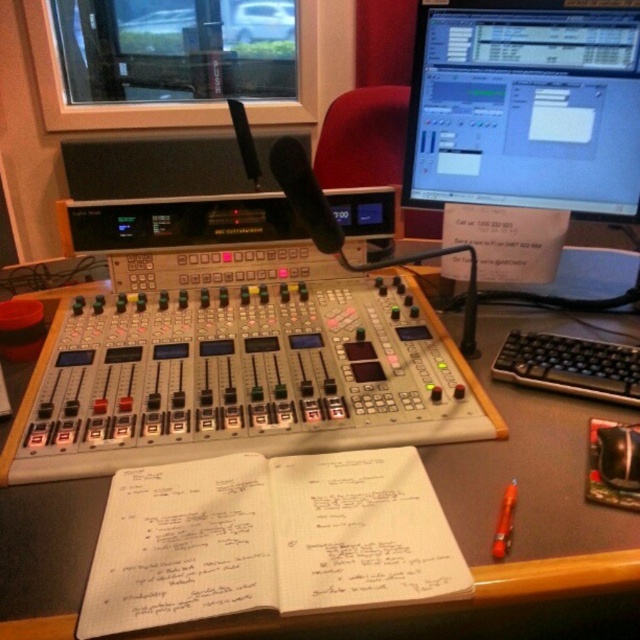
Question: Considering the real-world distances, which object is closest to the black plastic table at center?

Choices:
 (A) white paper notebook at center
 (B) black plastic keyboard at center-right

Answer: (A)

Question: Does black plastic table at center lie in front of matte black monitor at upper right?

Choices:
 (A) yes
 (B) no

Answer: (A)

Question: Which point is farther from the camera taking this photo?

Choices:
 (A) (440, 189)
 (B) (211, 563)
 (C) (632, 269)
 (D) (497, 376)

Answer: (C)

Question: Can you confirm if white paper notebook at center is bigger than black plastic keyboard at center-right?

Choices:
 (A) yes
 (B) no

Answer: (A)

Question: Which of these objects is positioned closest to the black plastic table at center?

Choices:
 (A) black plastic keyboard at center-right
 (B) white paper notebook at center
 (C) matte black monitor at upper right

Answer: (B)

Question: Does black plastic table at center come behind white paper notebook at center?

Choices:
 (A) no
 (B) yes

Answer: (B)